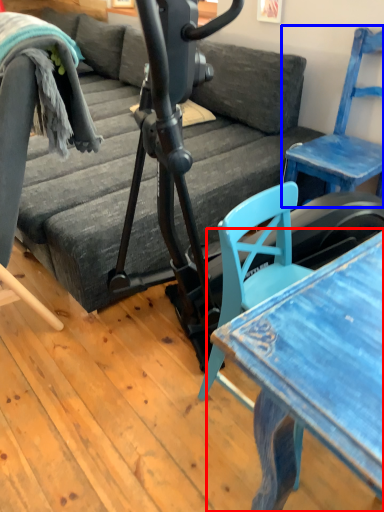
Question: Which of the following is the farthest to the observer, table (highlighted by a red box) or chair (highlighted by a blue box)?

Choices:
 (A) table
 (B) chair

Answer: (B)